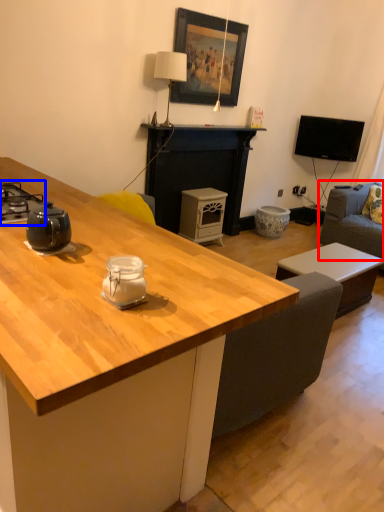
Question: Which object appears closest to the camera in this image, studio couch (highlighted by a red box) or gas stove (highlighted by a blue box)?

Choices:
 (A) studio couch
 (B) gas stove

Answer: (B)